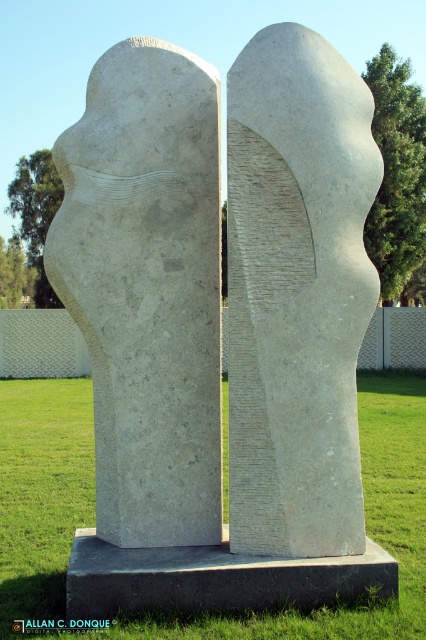
Which of these two, white stone sculpture at center or green grass at center, stands shorter?

green grass at center is shorter.

Can you confirm if white stone sculpture at center is positioned to the left of green grass at center?

In fact, white stone sculpture at center is to the right of green grass at center.

Identify the location of white stone sculpture at center. This screenshot has width=426, height=640. (296, 292).

Can you confirm if white stone sculpture at center is taller than gray concrete at center?

Yes.

Is white stone sculpture at center to the left of gray concrete at center from the viewer's perspective?

Yes, white stone sculpture at center is to the left of gray concrete at center.

Where is `white stone sculpture at center`? This screenshot has width=426, height=640. white stone sculpture at center is located at coordinates (296, 292).

Locate an element on the screen. Image resolution: width=426 pixels, height=640 pixels. white stone sculpture at center is located at coordinates (296, 292).

Is green grass at center taller than gray concrete at center?

Yes.

Can you confirm if green grass at center is smaller than gray concrete at center?

No.

Where is `green grass at center`? The height and width of the screenshot is (640, 426). green grass at center is located at coordinates (365, 529).